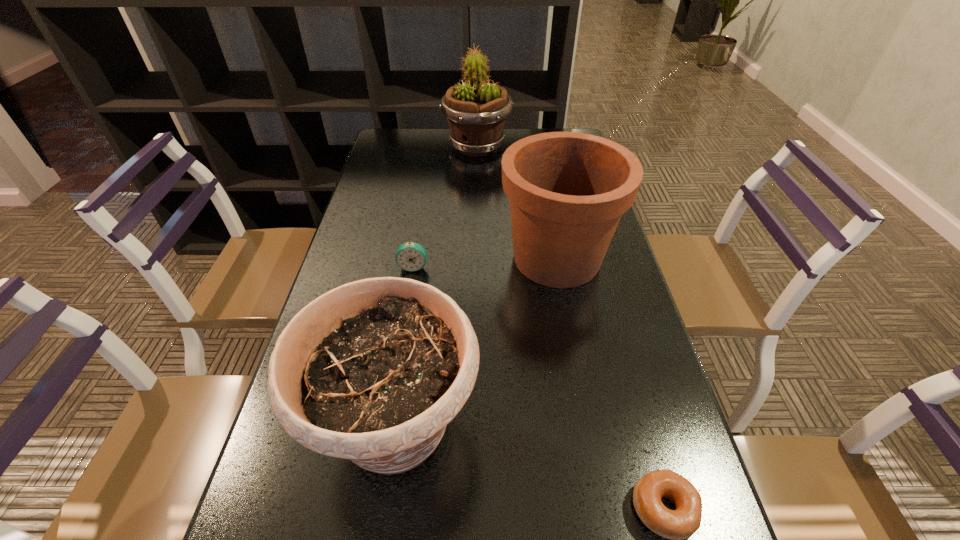
Identify the location of free spot between the farthest object and the nearest flowerpot. (436, 287).

Identify which object is the second closest to the nearest flowerpot. Please provide its 2D coordinates. Your answer should be formatted as a tuple, i.e. [(x, y)], where the tuple contains the x and y coordinates of a point satisfying the conditions above.

[(681, 523)]

Locate an element on the screen. The image size is (960, 540). object that is the second closest to the second shortest object is located at coordinates (372, 371).

At what (x,y) coordinates should I click in order to perform the action: click on the closest flowerpot to the farthest flowerpot. Please return your answer as a coordinate pair (x, y). This screenshot has height=540, width=960. Looking at the image, I should click on (567, 191).

Image resolution: width=960 pixels, height=540 pixels. Find the location of `flowerpot that is the third closest to the bagel`. flowerpot that is the third closest to the bagel is located at coordinates (476, 111).